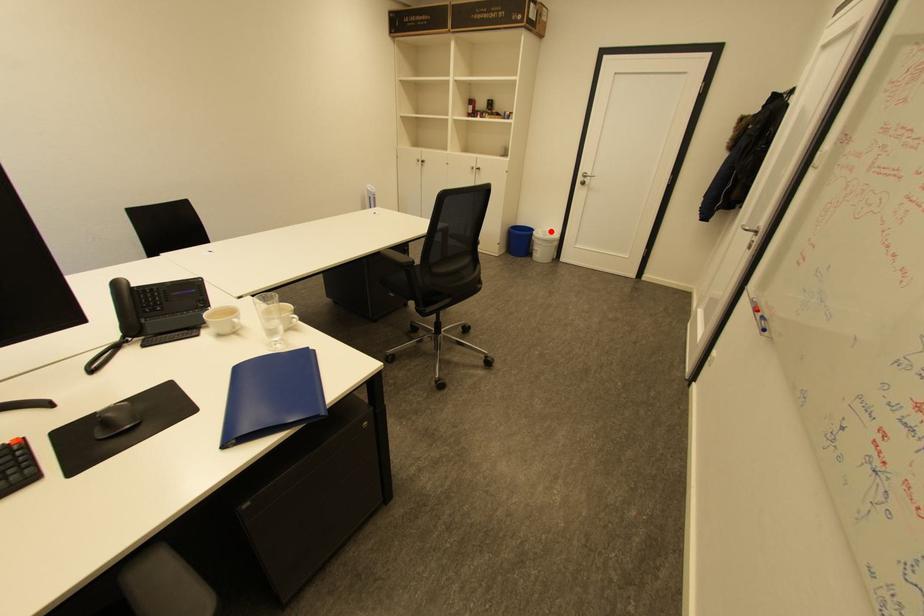
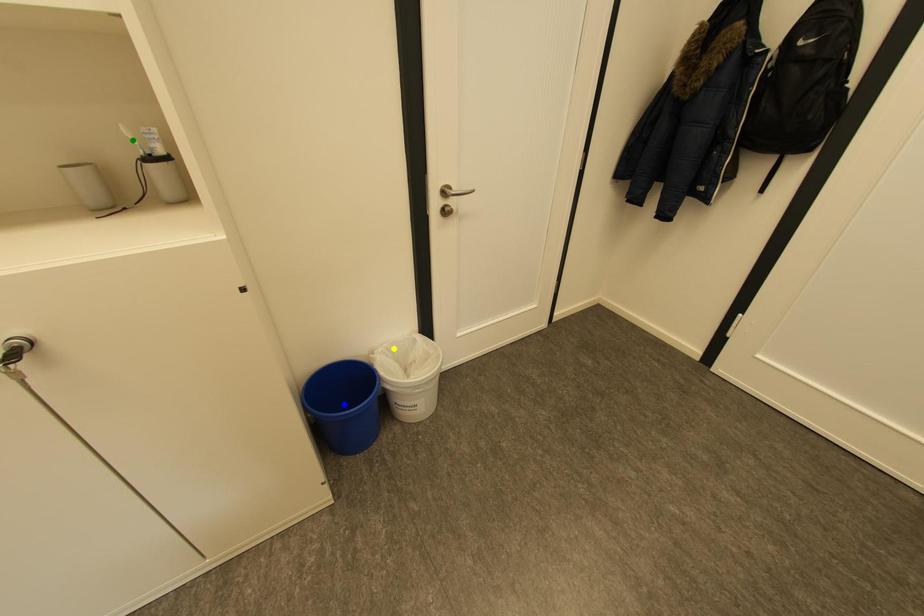
Question: I am providing you with two images of the same scene from different viewpoints. A red point is marked on the first image. You are given multiple points on the second image. Can you choose the point in image 2 that corresponds to the point in image 1?

Choices:
 (A) yellow point
 (B) blue point
 (C) green point

Answer: (A)